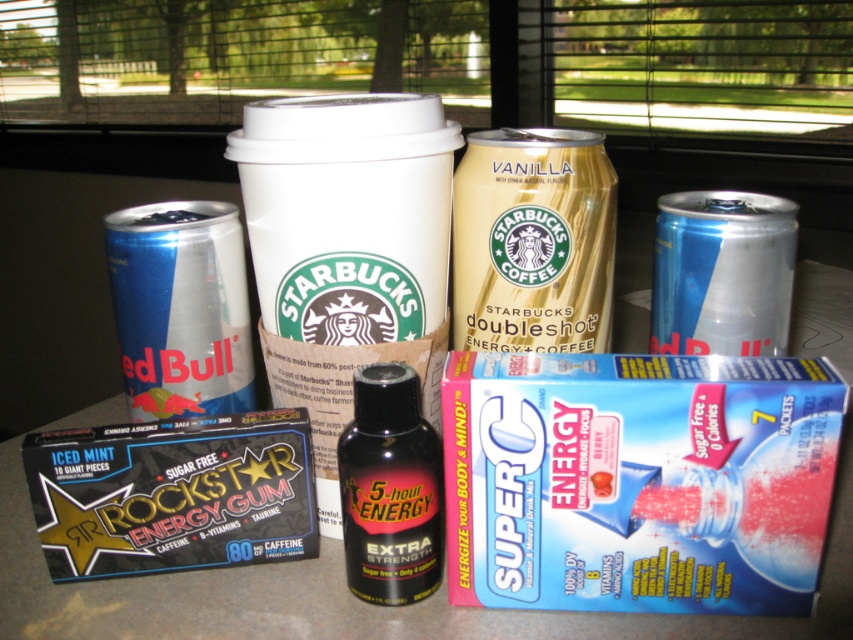
You are organizing a picnic and have two blue metallic cans in your basket. One is the blue metallic can at left and the other is the blue metallic can at upper right. If you want to carry both in a bag that can only hold one larger can and one smaller can, which can should go into the bag first?

The blue metallic can at left is larger than the blue metallic can at upper right, so you should place the blue metallic can at left first into the bag to ensure it fits properly before adding the smaller one.

You are a delivery person who needs to pick up the gold metallic can at center and the blue metallic can at upper right from the table. Which can should you grab first to ensure you don

You should grab the gold metallic can at center first because it is closer to you than the blue metallic can at upper right.

You are organizing a picnic and have brought both the blue metallic can at left and the black plastic bottle at center. You want to stack them in your backpack so the taller item is on the bottom for stability. Which item should you place at the bottom?

The blue metallic can at left is taller than the black plastic bottle at center, so you should place the blue metallic can at left at the bottom for stability.